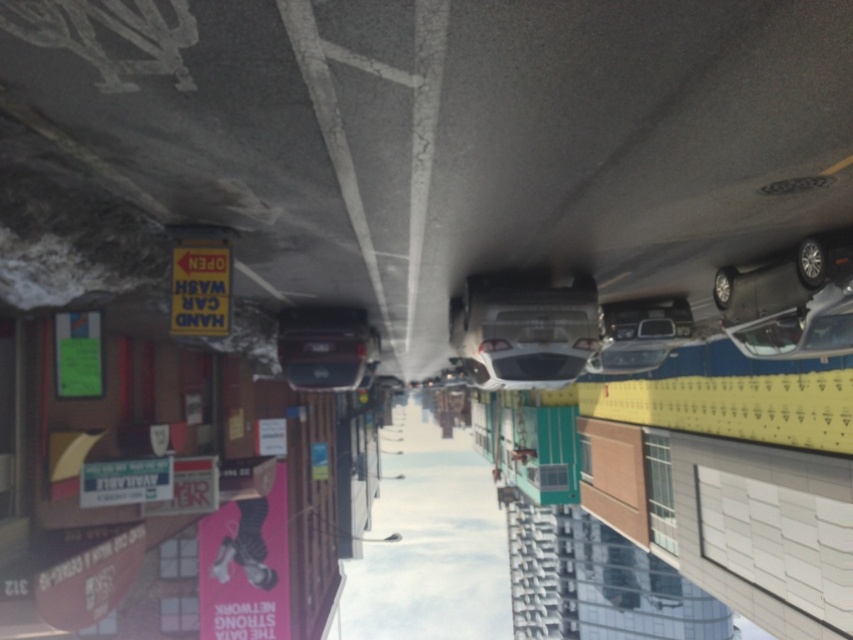
Is the position of white glossy car at center less distant than that of shiny silver car at upper right?

No, it is not.

Who is more forward, (538, 371) or (846, 228)?

Point (846, 228)

Where is `white glossy car at center`? white glossy car at center is located at coordinates (524, 326).

Between point (782, 280) and point (778, 353), which one is positioned in front?

Positioned in front is point (782, 280).

The image size is (853, 640). What do you see at coordinates (782, 278) in the screenshot?
I see `shiny silver car at upper right` at bounding box center [782, 278].

Image resolution: width=853 pixels, height=640 pixels. I want to click on shiny silver car at upper right, so click(782, 278).

Between white glossy car at center and shiny silver car at right, which one has less height?

Standing shorter between the two is shiny silver car at right.

Describe the element at coordinates (524, 326) in the screenshot. I see `white glossy car at center` at that location.

The image size is (853, 640). I want to click on white glossy car at center, so click(x=524, y=326).

At what (x,y) coordinates should I click in order to perform the action: click on white glossy car at center. Please return your answer as a coordinate pair (x, y). Looking at the image, I should click on (524, 326).